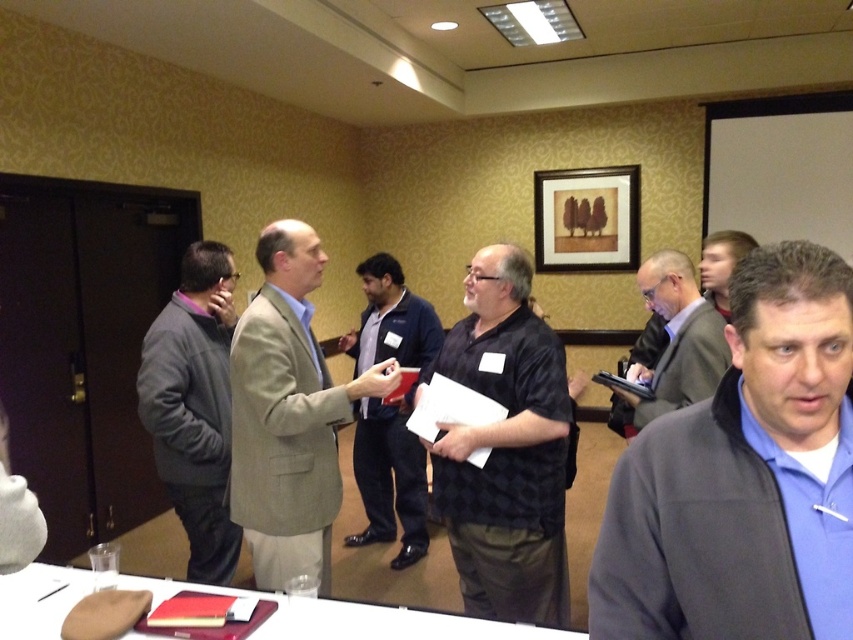
Question: Is blue fleece jacket at center closer to the viewer compared to dark blue shirt at center?

Choices:
 (A) yes
 (B) no

Answer: (A)

Question: Considering the real-world distances, which object is farthest from the matte black shirt at center?

Choices:
 (A) light beige textured blazer at center
 (B) black checkered shirt at center
 (C) wooden picture frame at upper center
 (D) dark blue shirt at center

Answer: (C)

Question: Which is farther from the black checkered shirt at center?

Choices:
 (A) dark blue shirt at center
 (B) wooden picture frame at upper center
 (C) smooth wood table at lower left

Answer: (B)

Question: Is light beige textured blazer at center thinner than gray fleece jacket at left?

Choices:
 (A) yes
 (B) no

Answer: (B)

Question: Is blue fleece jacket at center to the right of matte black shirt at center from the viewer's perspective?

Choices:
 (A) no
 (B) yes

Answer: (A)

Question: Which of the following is the farthest from the observer?

Choices:
 (A) smooth wood table at lower left
 (B) dark blue shirt at center

Answer: (B)